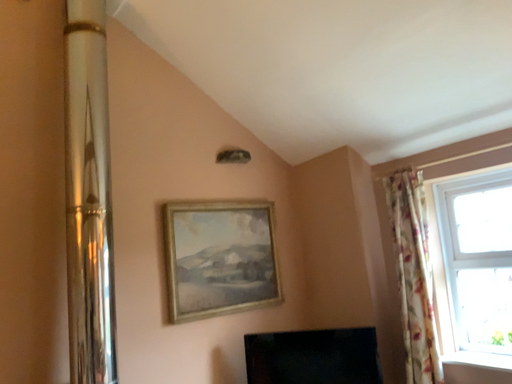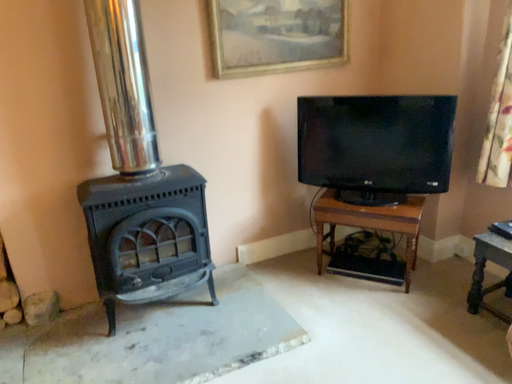
Question: How did the camera likely rotate when shooting the video?

Choices:
 (A) rotated left
 (B) rotated right

Answer: (A)